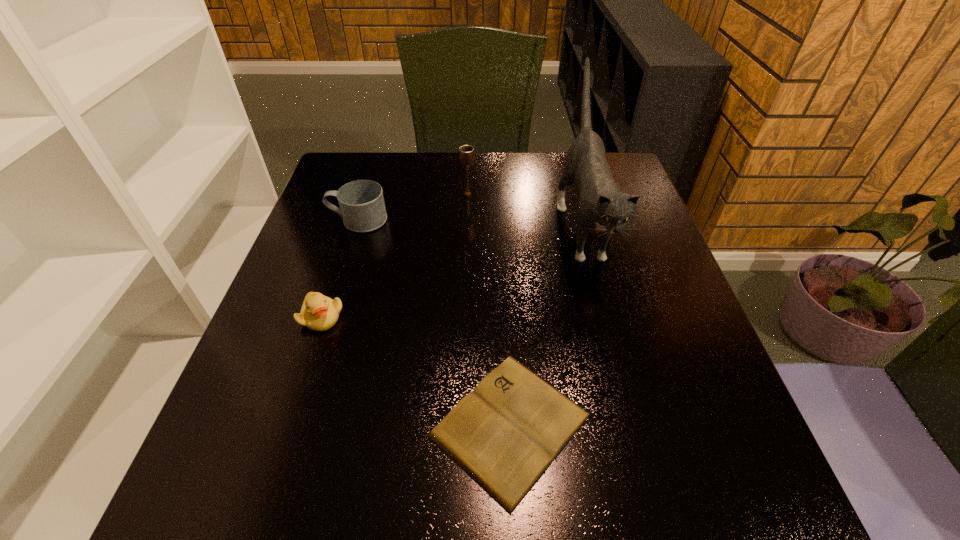
Where is `free space that satisfies the following two spatial constraints: 1. on the side of the third shortest object with the handle; 2. on the beak of the second nearest object`? Image resolution: width=960 pixels, height=540 pixels. free space that satisfies the following two spatial constraints: 1. on the side of the third shortest object with the handle; 2. on the beak of the second nearest object is located at coordinates (327, 317).

At what (x,y) coordinates should I click in order to perform the action: click on vacant point that satisfies the following two spatial constraints: 1. on the side of the third shortest object with the handle; 2. on the beak of the second shortest object. Please return your answer as a coordinate pair (x, y). This screenshot has height=540, width=960. Looking at the image, I should click on (327, 317).